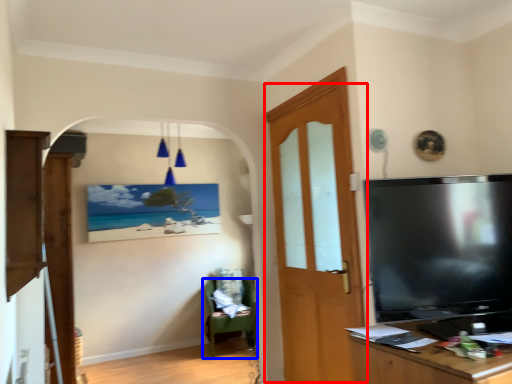
Question: Which object appears closest to the camera in this image, door (highlighted by a red box) or chair (highlighted by a blue box)?

Choices:
 (A) door
 (B) chair

Answer: (A)